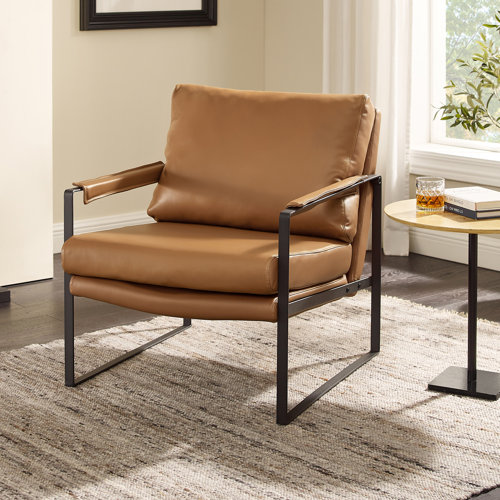
Find the location of a particular element. This screenshot has height=500, width=500. grey rug is located at coordinates (120, 444), (365, 421), (404, 343).